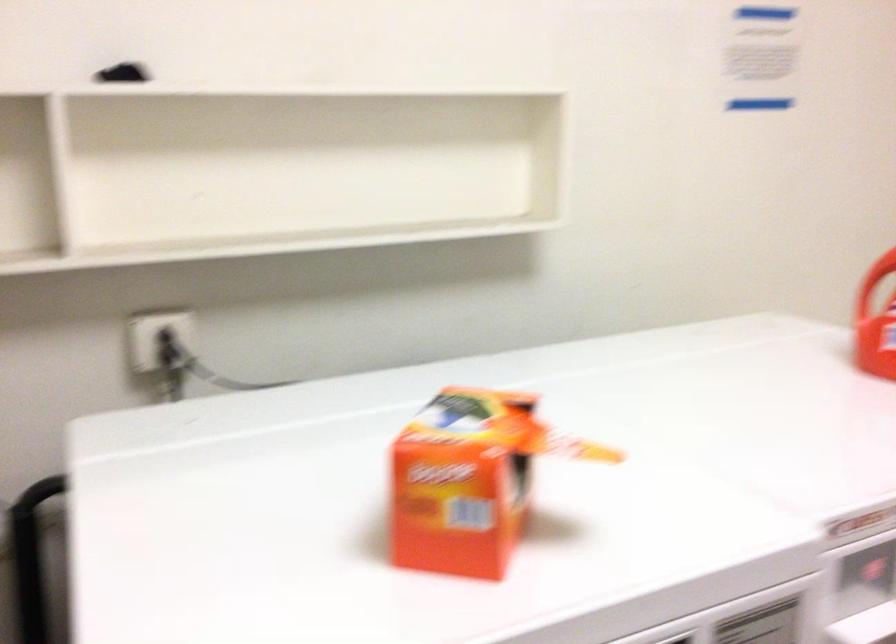
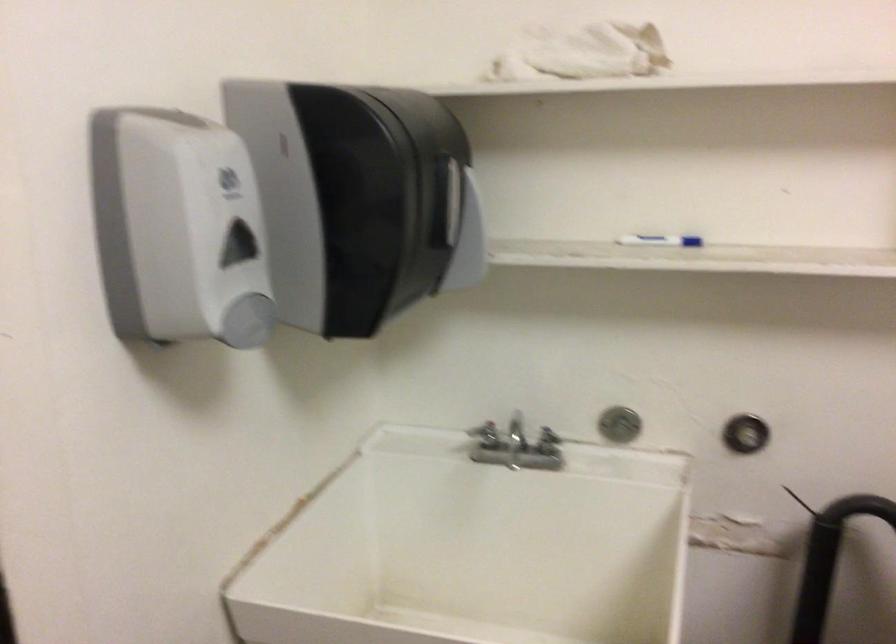
Question: The camera is either moving clockwise (left) or counter-clockwise (right) around the object. The first image is from the beginning of the video and the second image is from the end. Is the camera moving left or right when shooting the video?

Choices:
 (A) Left
 (B) Right

Answer: (B)